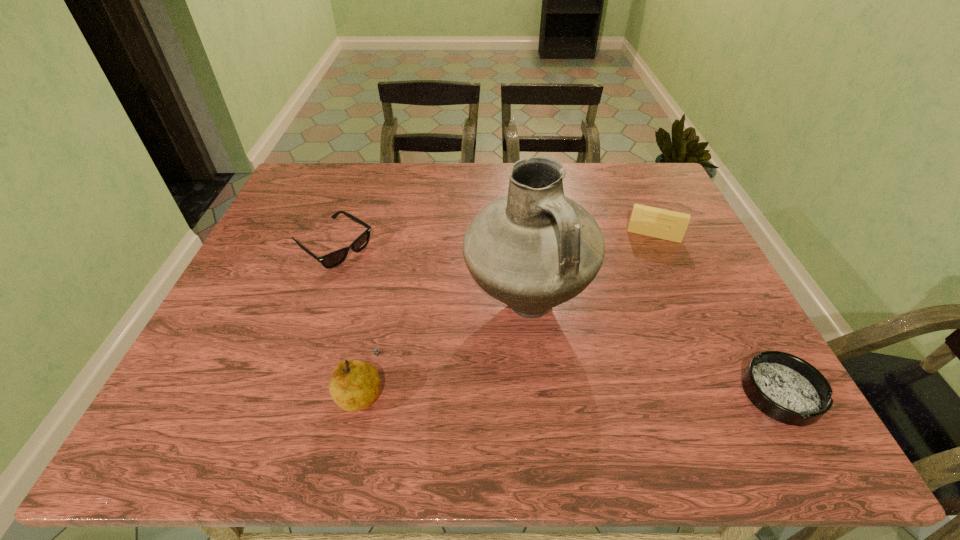
What are the coordinates of `the second tallest object` in the screenshot? It's located at (354, 385).

What are the coordinates of `the second object from left to right` in the screenshot? It's located at (354, 385).

Identify the location of ashtray. The height and width of the screenshot is (540, 960). tap(786, 388).

Identify the location of the leftmost object. This screenshot has width=960, height=540. (333, 259).

You are a GUI agent. You are given a task and a screenshot of the screen. Output one action in this format:
    pyautogui.click(x=<x>, y=<y>)
    Task: Click on the fourth tallest object
    The width and height of the screenshot is (960, 540).
    Given the screenshot: What is the action you would take?
    pyautogui.click(x=333, y=259)

Find the location of `videotape`. videotape is located at coordinates (664, 224).

Image resolution: width=960 pixels, height=540 pixels. What are the coordinates of `the third object from right to left` in the screenshot? It's located at (533, 249).

Image resolution: width=960 pixels, height=540 pixels. Identify the location of pitcher. (533, 249).

This screenshot has width=960, height=540. I want to click on vacant region located 0.270m on the left of the fourth object from right to left, so click(200, 390).

Identify the location of blank space located 0.110m on the back of the shortest object. [x=741, y=322].